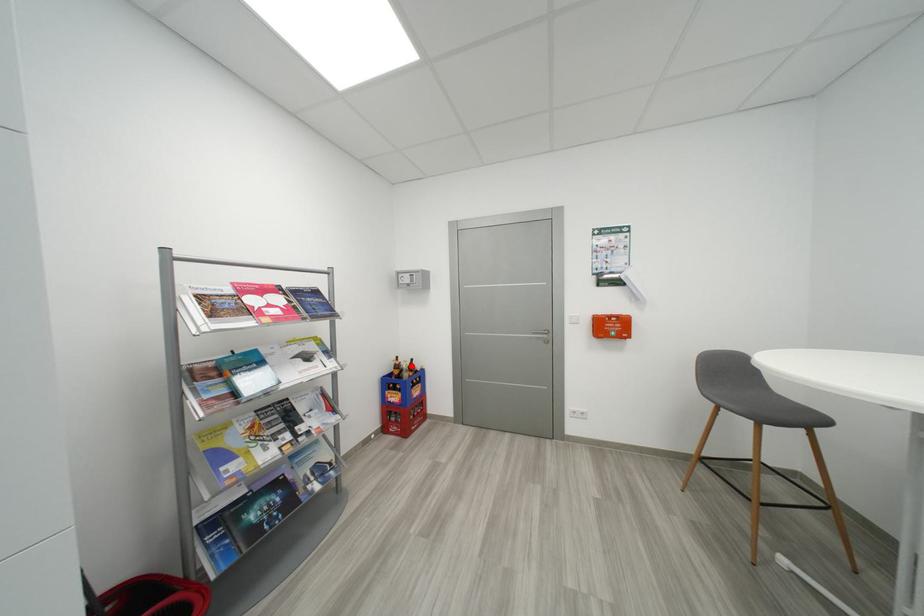
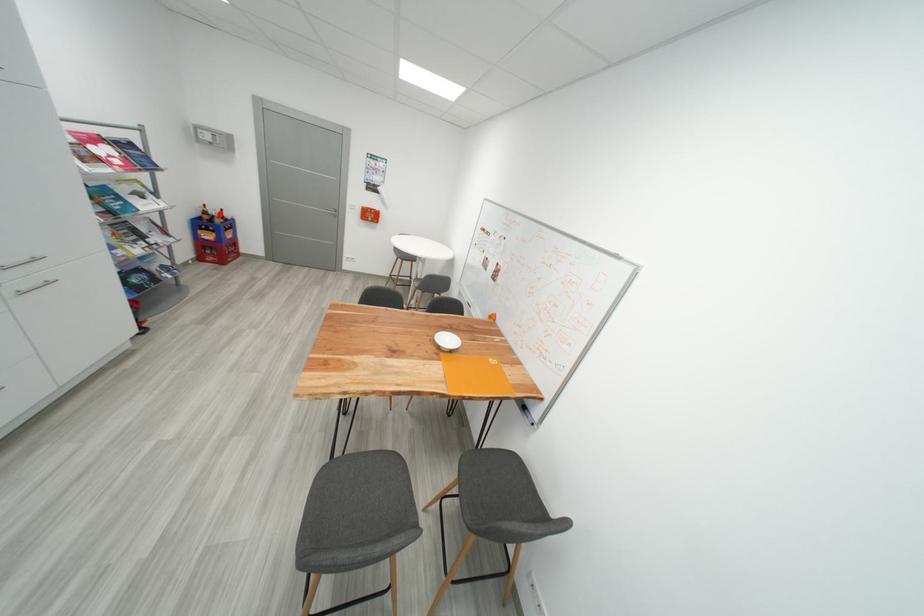
I am providing you with two images of the same scene from different viewpoints. A red point is marked on the first image and another point is marked on the second image. Do the highlighted points in image1 and image2 indicate the same real-world spot?

Yes